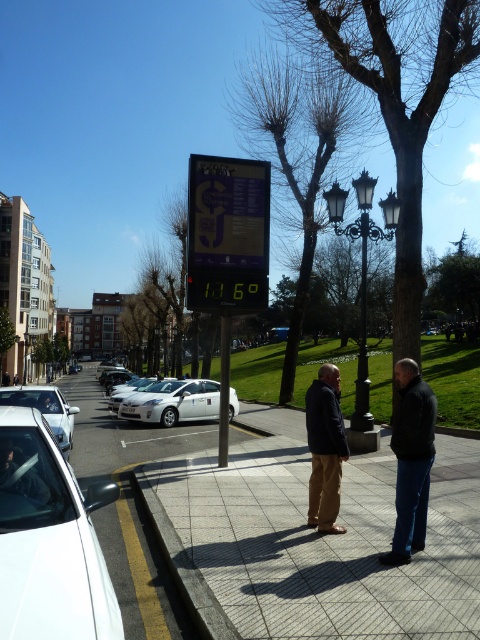
Question: Considering the real-world distances, which object is closest to the white glossy sedan at lower left?

Choices:
 (A) dark brown pants at center
 (B) dark gray jacket at center
 (C) white glossy car at lower left

Answer: (C)

Question: Among these points, which one is farthest from the camera?

Choices:
 (A) (250, 205)
 (B) (330, 432)
 (C) (432, 428)
 (D) (123, 396)

Answer: (D)

Question: Does dark gray jacket at center have a lesser width compared to white glossy sedan at lower left?

Choices:
 (A) no
 (B) yes

Answer: (B)

Question: Among these objects, which one is nearest to the camera?

Choices:
 (A) white glossy car at center
 (B) dark gray jacket at center

Answer: (B)

Question: Can you confirm if dark brown pants at center is thinner than white glossy car at center?

Choices:
 (A) yes
 (B) no

Answer: (A)

Question: Is gray concrete sidewalk at center in front of dark gray jacket at center?

Choices:
 (A) no
 (B) yes

Answer: (B)